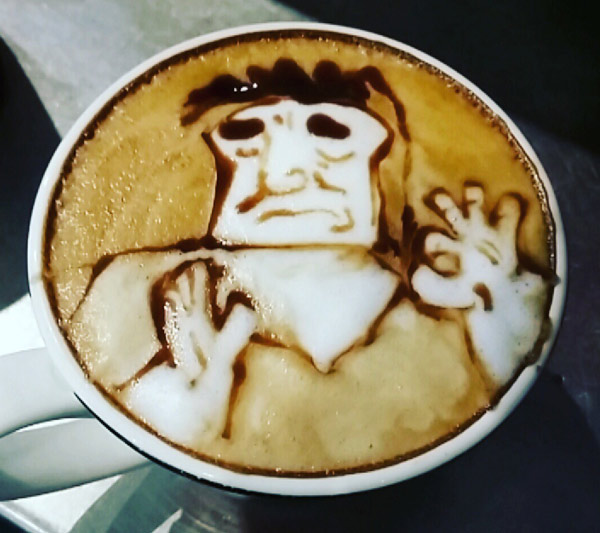
The height and width of the screenshot is (533, 600). I want to click on cappuccino mug, so click(x=346, y=489).